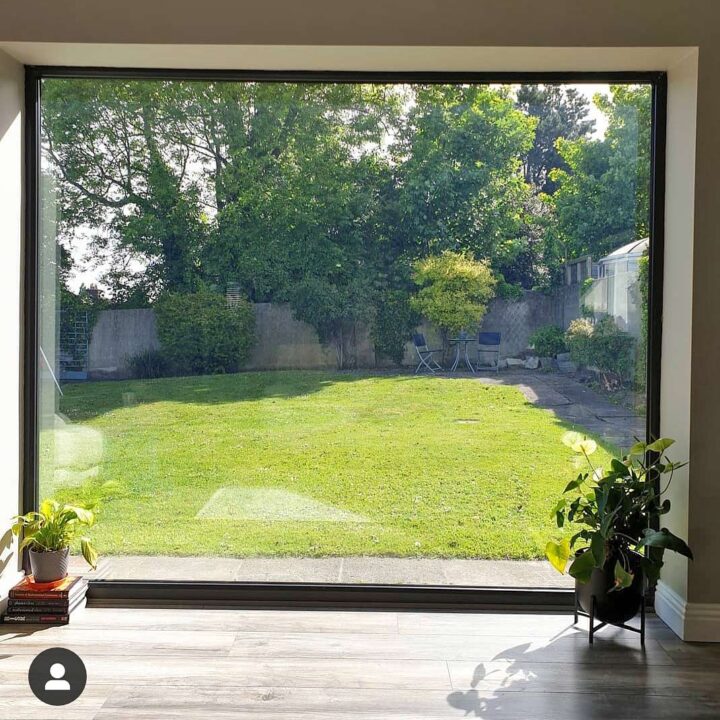
I want to click on chairs, so click(x=485, y=337), click(x=425, y=348).